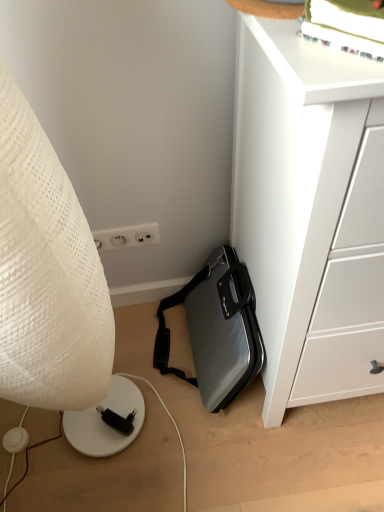
This screenshot has width=384, height=512. I want to click on vacant space underneath silver textured briefcase at lower center (from a real-world perspective), so click(x=188, y=378).